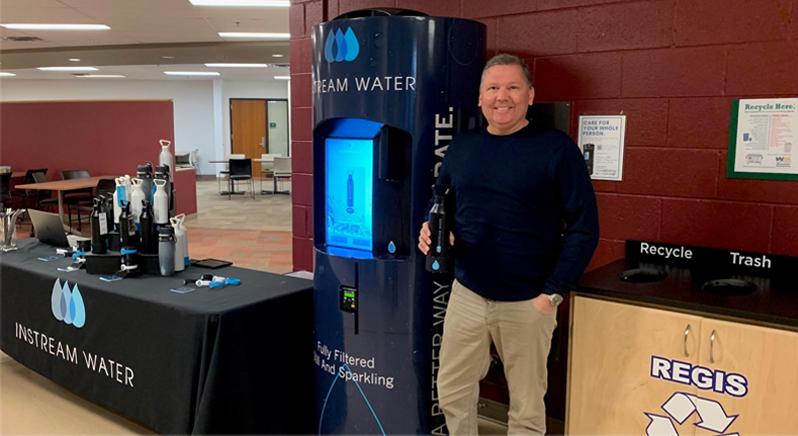
At what (x,y) coordinates should I click in order to perform the action: click on table cloth. Please return your answer as a coordinate pair (x, y). This screenshot has height=436, width=798. Looking at the image, I should click on (207, 292).